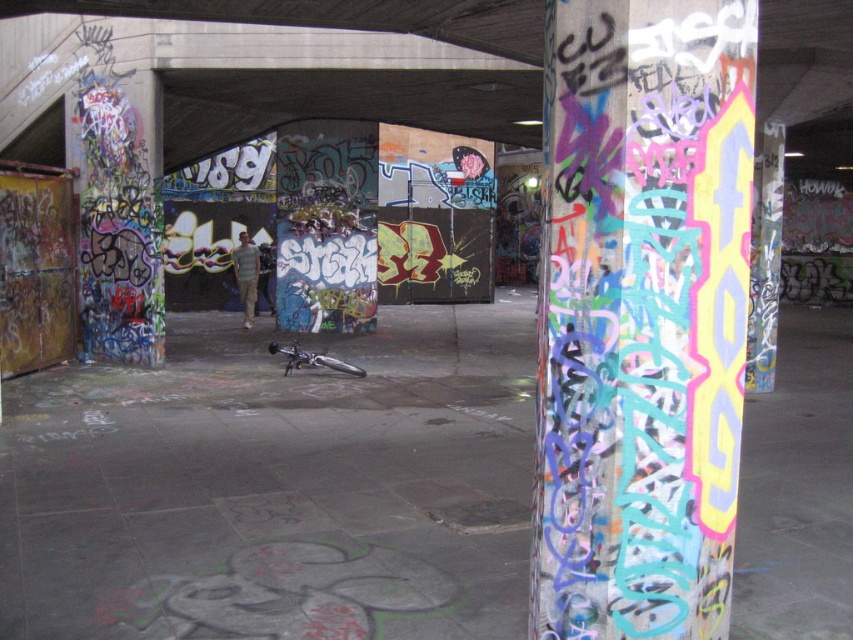
Question: Can you confirm if multicolored graffiti-covered pillar at center is positioned to the left of striped cotton shirt at center?

Choices:
 (A) no
 (B) yes

Answer: (A)

Question: Does multicolored graffiti-covered pillar at center appear under striped cotton shirt at center?

Choices:
 (A) yes
 (B) no

Answer: (A)

Question: Considering the relative positions of multicolored graffiti-covered pillar at center and striped cotton shirt at center in the image provided, where is multicolored graffiti-covered pillar at center located with respect to striped cotton shirt at center?

Choices:
 (A) right
 (B) left

Answer: (A)

Question: Which object appears farthest from the camera in this image?

Choices:
 (A) multicolored graffiti-covered pillar at center
 (B) striped cotton shirt at center

Answer: (B)

Question: Which point is farther to the camera?

Choices:
 (A) (236, 269)
 (B) (700, 22)

Answer: (A)